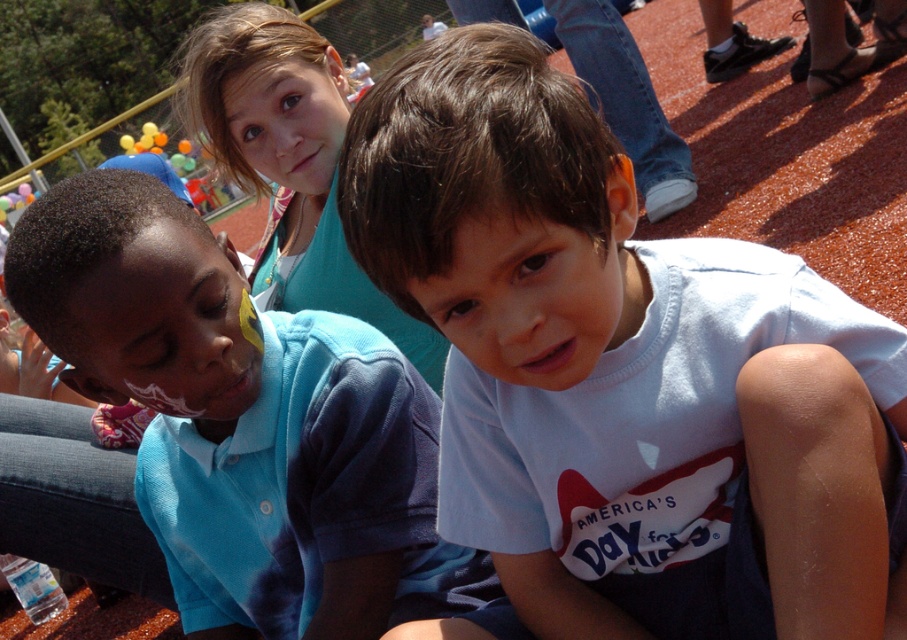
Question: Which point appears farthest from the camera in this image?

Choices:
 (A) (367, 429)
 (B) (398, 196)

Answer: (A)

Question: Does white cotton shirt at center have a smaller size compared to blue tie-dye polo shirt at left?

Choices:
 (A) yes
 (B) no

Answer: (A)

Question: Can you confirm if white cotton shirt at center is positioned to the right of blue tie-dye polo shirt at left?

Choices:
 (A) yes
 (B) no

Answer: (A)

Question: Which point is closer to the camera?

Choices:
 (A) (696, 280)
 (B) (196, 544)

Answer: (A)

Question: Considering the relative positions of white cotton shirt at center and blue tie-dye polo shirt at left in the image provided, where is white cotton shirt at center located with respect to blue tie-dye polo shirt at left?

Choices:
 (A) left
 (B) right

Answer: (B)